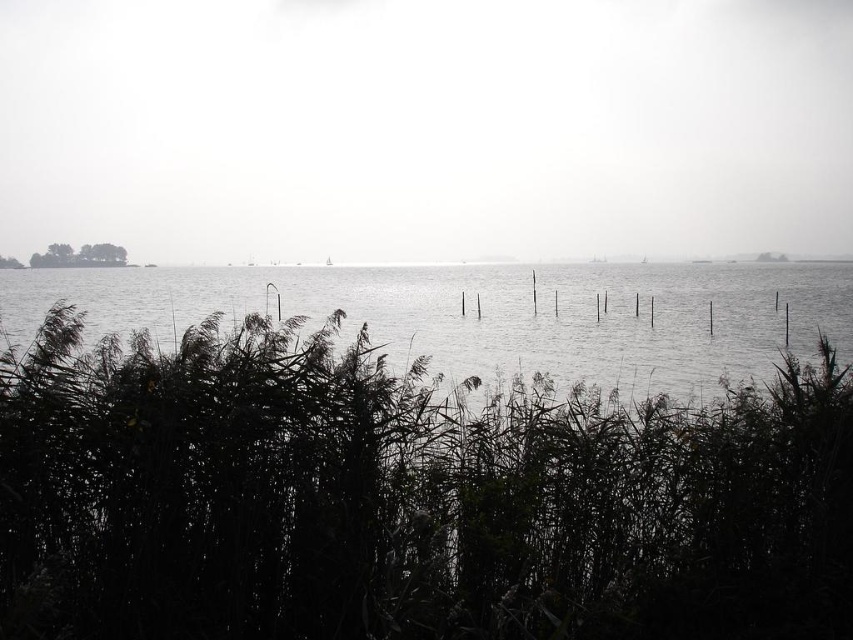
Question: Which point is closer to the camera taking this photo?

Choices:
 (A) (245, 307)
 (B) (688, 557)

Answer: (B)

Question: Is transparent water at center thinner than clear water at center?

Choices:
 (A) no
 (B) yes

Answer: (A)

Question: Can you confirm if dark green grass at lower center is positioned below clear water at center?

Choices:
 (A) yes
 (B) no

Answer: (A)

Question: Which object is the farthest from the dark green grass at lower center?

Choices:
 (A) clear water at center
 (B) transparent water at center

Answer: (B)

Question: Which of these objects is positioned closest to the clear water at center?

Choices:
 (A) dark green grass at lower center
 (B) transparent water at center

Answer: (B)

Question: Where is dark green grass at lower center located in relation to clear water at center in the image?

Choices:
 (A) below
 (B) above

Answer: (A)